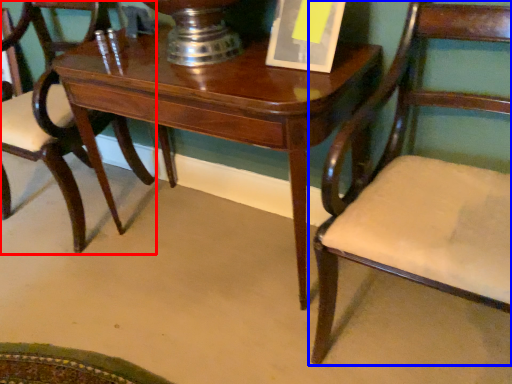
Question: Which object appears closest to the camera in this image, chair (highlighted by a red box) or chair (highlighted by a blue box)?

Choices:
 (A) chair
 (B) chair

Answer: (B)